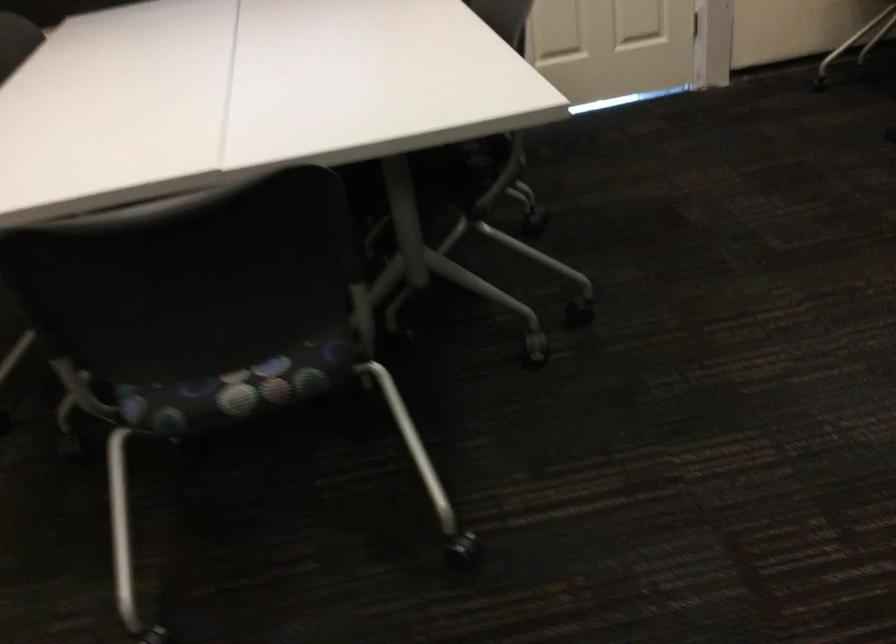
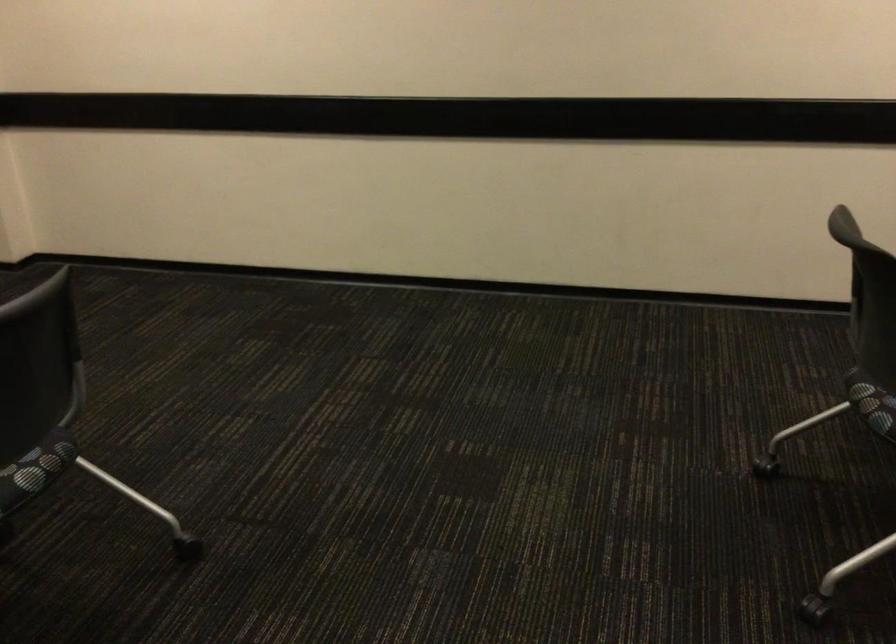
Find the pixel in the second image that matches (x=250, y=401) in the first image.

(874, 408)